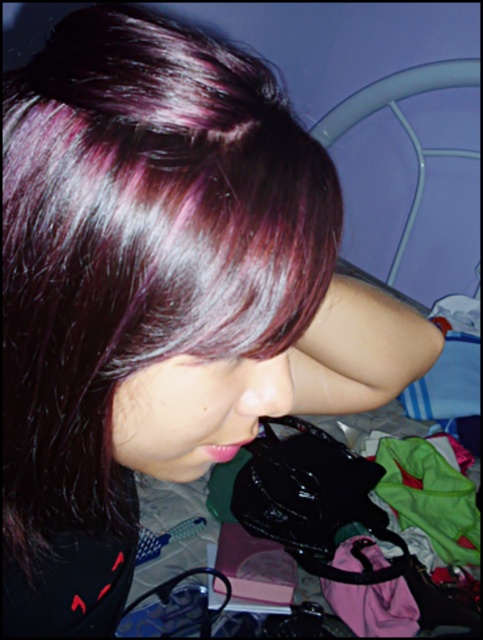
Question: In this image, where is green fabric at lower right located relative to purple fabric at lower right?

Choices:
 (A) below
 (B) above

Answer: (B)

Question: Can you confirm if green fabric at lower right is thinner than purple fabric at lower right?

Choices:
 (A) no
 (B) yes

Answer: (A)

Question: Which of the following is the farthest from the observer?

Choices:
 (A) green fabric at lower right
 (B) purple fabric at lower right

Answer: (A)

Question: Among these objects, which one is farthest from the camera?

Choices:
 (A) green fabric at lower right
 (B) purple fabric at lower right

Answer: (A)

Question: Does green fabric at lower right have a smaller size compared to purple fabric at lower right?

Choices:
 (A) yes
 (B) no

Answer: (B)

Question: Which object is closer to the camera taking this photo?

Choices:
 (A) purple fabric at lower right
 (B) green fabric at lower right

Answer: (A)